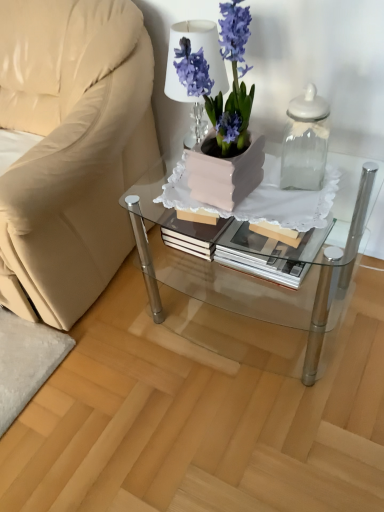
At what (x,y) coordinates should I click in order to perform the action: click on free location in front of clear glass coffee table at center. Please return your answer as a coordinate pair (x, y). The width and height of the screenshot is (384, 512). Looking at the image, I should click on (258, 424).